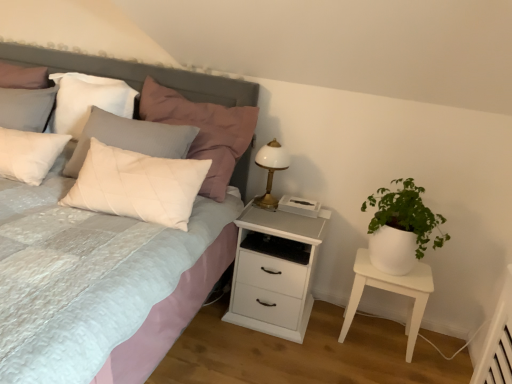
Identify the location of matte gray headboard at upper left. (x=136, y=74).

The width and height of the screenshot is (512, 384). What do you see at coordinates (203, 131) in the screenshot?
I see `white quilted pillow at upper left, which ranks as the 2th pillow in left-to-right order` at bounding box center [203, 131].

This screenshot has width=512, height=384. In order to click on white glossy bedside lamp at upper right in this screenshot , I will do `click(270, 170)`.

Measure the distance between white glossy bedside lamp at upper right and camera.

The distance of white glossy bedside lamp at upper right from camera is 7.49 feet.

Image resolution: width=512 pixels, height=384 pixels. What do you see at coordinates (399, 227) in the screenshot?
I see `green leafy plant in white pot at right` at bounding box center [399, 227].

What do you see at coordinates (391, 291) in the screenshot? This screenshot has height=384, width=512. I see `white matte table at right` at bounding box center [391, 291].

The width and height of the screenshot is (512, 384). What do you see at coordinates (274, 272) in the screenshot?
I see `white matte nightstand at center` at bounding box center [274, 272].

You are a GUI agent. You are given a task and a screenshot of the screen. Output one action in this format:
    pyautogui.click(x=<x>, y=<y>)
    Task: Click on the matte gray headboard at upper left
    This screenshot has height=384, width=512.
    Given the screenshot: What is the action you would take?
    pyautogui.click(x=136, y=74)

Is matte gray headboard at upper left inside the boundaries of white quilted fabric bed at upper left, or outside?

matte gray headboard at upper left can be found inside white quilted fabric bed at upper left.

Based on the photo, which object is closer to the camera, matte gray headboard at upper left or white quilted fabric bed at upper left?

white quilted fabric bed at upper left.

Based on their positions, is matte gray headboard at upper left located to the left or right of white quilted fabric bed at upper left?

Clearly, matte gray headboard at upper left is on the right of white quilted fabric bed at upper left in the image.

Based on the photo, from the image's perspective, relative to white quilted pillow at upper left, the first pillow viewed from the left, is white matte nightstand at center above or below?

white matte nightstand at center is situated lower than white quilted pillow at upper left, the first pillow viewed from the left, in the image.

Where is `pillow that is behind the white matte nightstand at center`? The width and height of the screenshot is (512, 384). pillow that is behind the white matte nightstand at center is located at coordinates (88, 100).

Between white matte nightstand at center and white quilted pillow at upper left, the first pillow viewed from the left, which one is positioned behind?

white quilted pillow at upper left, the first pillow viewed from the left, is more distant.

Considering the points (297, 310) and (124, 113), which point is in front, point (297, 310) or point (124, 113)?

Positioned in front is point (297, 310).

From the image's perspective, which object appears higher, white glossy bedside lamp at upper right or green leafy plant in white pot at right?

white glossy bedside lamp at upper right, from the image's perspective.

Is white glossy bedside lamp at upper right positioned with its back to green leafy plant in white pot at right?

No, white glossy bedside lamp at upper right's orientation is not away from green leafy plant in white pot at right.

Between white glossy bedside lamp at upper right and green leafy plant in white pot at right, which one has larger width?

With larger width is green leafy plant in white pot at right.

Consider the image. Considering the sizes of objects matte gray headboard at upper left and white matte nightstand at center in the image provided, who is shorter, matte gray headboard at upper left or white matte nightstand at center?

With less height is white matte nightstand at center.

Is matte gray headboard at upper left next to white matte nightstand at center?

No, matte gray headboard at upper left is not in contact with white matte nightstand at center.

Can you confirm if matte gray headboard at upper left is positioned to the left of white matte nightstand at center?

Indeed, matte gray headboard at upper left is positioned on the left side of white matte nightstand at center.

Is white matte nightstand at center directly adjacent to green leafy plant in white pot at right?

No.

Considering the positions of points (282, 269) and (380, 253), is point (282, 269) farther from camera compared to point (380, 253)?

Yes, point (282, 269) is behind point (380, 253).

Is white matte nightstand at center oriented towards green leafy plant in white pot at right?

No, white matte nightstand at center does not turn towards green leafy plant in white pot at right.

Based on the photo, how much distance is there between white matte nightstand at center and green leafy plant in white pot at right?

They are 18.71 inches apart.

Would you say white matte nightstand at center is a long distance from white matte table at right?

Actually, white matte nightstand at center and white matte table at right are a little close together.

Find the location of a particular element. The width and height of the screenshot is (512, 384). nightstand located on the left of white matte table at right is located at coordinates (274, 272).

Choose the correct answer: Is white matte nightstand at center inside white matte table at right or outside it?

white matte nightstand at center is outside white matte table at right.

From a real-world perspective, is white matte nightstand at center positioned under white matte table at right based on gravity?

No.

Is white matte table at right positioned in front of white quilted fabric bed at upper left?

No.

Between point (423, 310) and point (197, 73), which one is positioned in front?

The point (423, 310) is in front.

Based on the photo, considering the relative sizes of white matte table at right and white quilted fabric bed at upper left in the image provided, is white matte table at right thinner than white quilted fabric bed at upper left?

Yes.

Where is `headboard above the white quilted fabric bed at upper left (from a real-world perspective)`? headboard above the white quilted fabric bed at upper left (from a real-world perspective) is located at coordinates (136, 74).

At what (x,y) coordinates should I click in order to perform the action: click on pillow behind the white matte nightstand at center. Please return your answer as a coordinate pair (x, y). This screenshot has width=512, height=384. Looking at the image, I should click on (88, 100).

Estimate the real-world distances between objects in this image. Which object is further from matte gray headboard at upper left, white quilted pillow at upper left, which ranks as the 2th pillow in left-to-right order, or white quilted pillow at upper left, the first pillow viewed from the left?

Among the two, white quilted pillow at upper left, which ranks as the 2th pillow in left-to-right order, is located further to matte gray headboard at upper left.

From the image, which object appears to be farther from white glossy bedside lamp at upper right, white matte nightstand at center or white quilted pillow at upper left, the 1th pillow positioned from the right?

white matte nightstand at center is positioned further to the anchor white glossy bedside lamp at upper right.

Estimate the real-world distances between objects in this image. Which object is further from white quilted pillow at upper left, the 1th pillow positioned from the right, matte gray headboard at upper left or green leafy plant in white pot at right?

The object further to white quilted pillow at upper left, the 1th pillow positioned from the right, is green leafy plant in white pot at right.

Based on their spatial positions, is white matte nightstand at center or white quilted fabric bed at upper left further from white matte table at right?

Based on the image, white quilted fabric bed at upper left appears to be further to white matte table at right.

Based on their spatial positions, is white quilted fabric bed at upper left or white quilted pillow at upper left, the first pillow viewed from the left, further from white matte nightstand at center?

The object further to white matte nightstand at center is white quilted pillow at upper left, the first pillow viewed from the left.

From the image, which object appears to be farther from green leafy plant in white pot at right, white matte table at right or white matte nightstand at center?

white matte nightstand at center is positioned further to the anchor green leafy plant in white pot at right.

When comparing their distances from white matte table at right, does white quilted fabric bed at upper left or white quilted pillow at upper left, the 1th pillow positioned from the right, seem closer?

white quilted pillow at upper left, the 1th pillow positioned from the right, lies closer to white matte table at right than the other object.

Estimate the real-world distances between objects in this image. Which object is further from matte gray headboard at upper left, green leafy plant in white pot at right or white quilted fabric bed at upper left?

Based on the image, green leafy plant in white pot at right appears to be further to matte gray headboard at upper left.

Find the location of a particular element. The image size is (512, 384). bedside lamp between matte gray headboard at upper left and green leafy plant in white pot at right from left to right is located at coordinates [x=270, y=170].

You are a GUI agent. You are given a task and a screenshot of the screen. Output one action in this format:
    pyautogui.click(x=<x>, y=<y>)
    Task: Click on the headboard located between white quilted fabric bed at upper left and white quilted pillow at upper left, which ranks as the 2th pillow in left-to-right order, in the depth direction
    The image size is (512, 384).
    Given the screenshot: What is the action you would take?
    pyautogui.click(x=136, y=74)

Find the location of a particular element. This screenshot has height=384, width=512. bedside lamp between white quilted pillow at upper left, the 1th pillow positioned from the right, and green leafy plant in white pot at right is located at coordinates (270, 170).

Find the location of `headboard between white quilted fabric bed at upper left and white quilted pillow at upper left, arranged as the 2th pillow when viewed from the right, along the z-axis`. headboard between white quilted fabric bed at upper left and white quilted pillow at upper left, arranged as the 2th pillow when viewed from the right, along the z-axis is located at coordinates (136, 74).